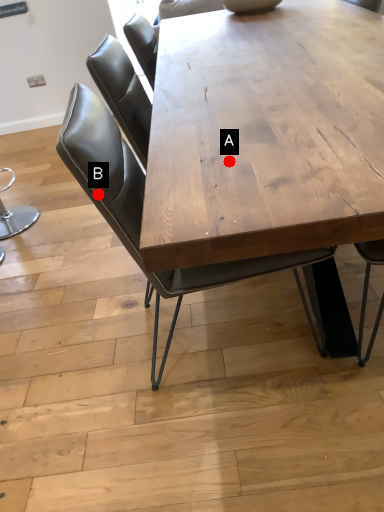
Question: Two points are circled on the image, labeled by A and B beside each circle. Which of the following is the closest to the observer?

Choices:
 (A) A is closer
 (B) B is closer

Answer: (A)